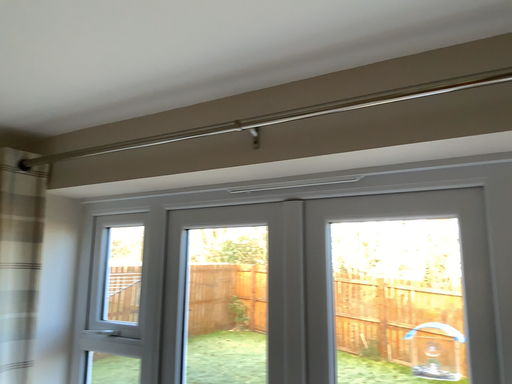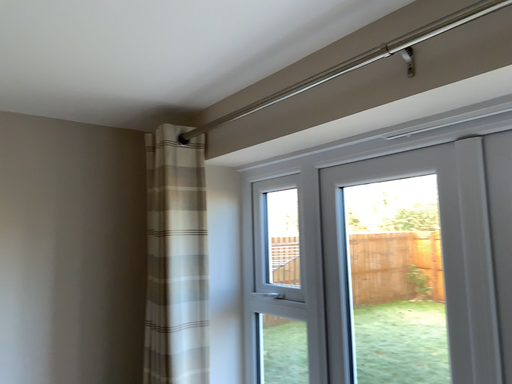
Question: How did the camera likely rotate when shooting the video?

Choices:
 (A) rotated left
 (B) rotated right

Answer: (A)